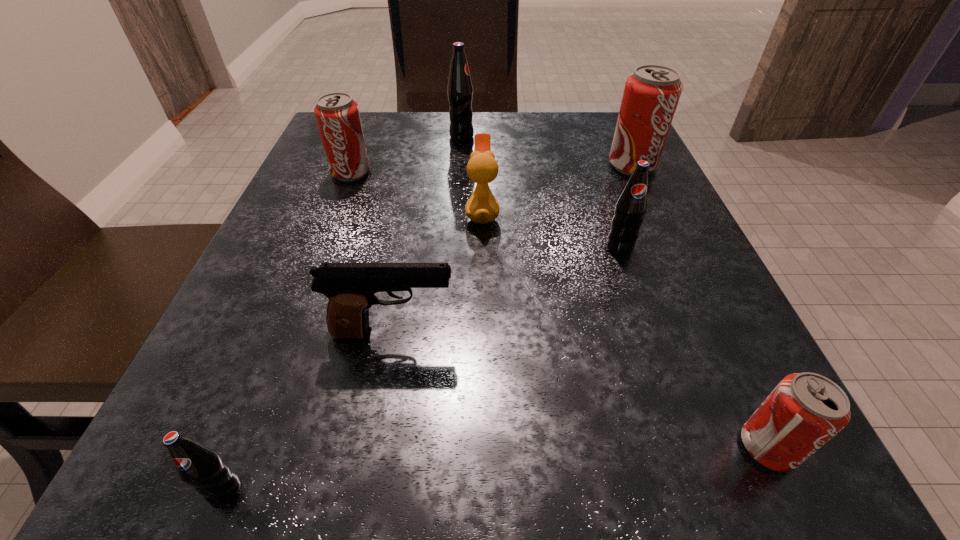
At what (x,y) coordinates should I click in order to perform the action: click on the third pop from left to right. Please return your answer as a coordinate pair (x, y). Looking at the image, I should click on (x=460, y=90).

You are a GUI agent. You are given a task and a screenshot of the screen. Output one action in this format:
    pyautogui.click(x=<x>, y=<y>)
    Task: Click on the farthest black pop
    The image size is (960, 540).
    Given the screenshot: What is the action you would take?
    pyautogui.click(x=460, y=90)

Where is `the biggest pink soda can`? The height and width of the screenshot is (540, 960). the biggest pink soda can is located at coordinates (651, 94).

This screenshot has height=540, width=960. What are the coordinates of `the second smallest pink soda can` in the screenshot? It's located at pos(337,114).

This screenshot has width=960, height=540. I want to click on the third object from right to left, so click(631, 206).

Image resolution: width=960 pixels, height=540 pixels. I want to click on the second biggest black pop, so click(x=631, y=206).

The height and width of the screenshot is (540, 960). I want to click on black pistol, so click(x=350, y=287).

What are the coordinates of `pistol` in the screenshot? It's located at (350, 287).

Locate an element on the screen. This screenshot has width=960, height=540. the fourth farthest object is located at coordinates (482, 207).

Identify the location of tan duck. The width and height of the screenshot is (960, 540). (482, 207).